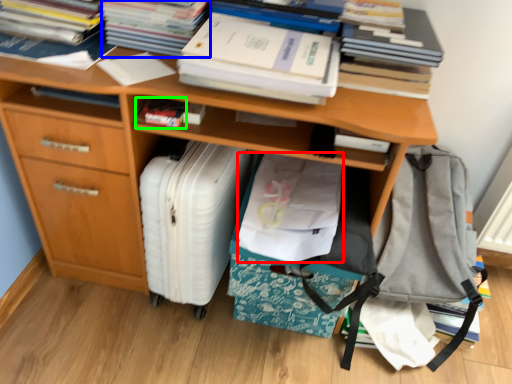
Question: Which is farther away from material (highlighted by a red box)? paperback book (highlighted by a blue box) or paperback book (highlighted by a green box)?

Choices:
 (A) paperback book
 (B) paperback book

Answer: (A)